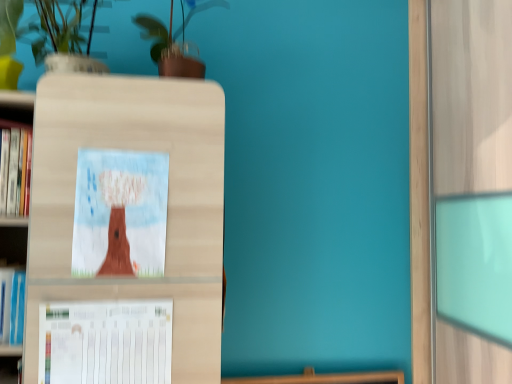
Question: Considering their positions, is white paper at lower left located in front of or behind green glossy plant at upper center?

Choices:
 (A) front
 (B) behind

Answer: (A)

Question: Would you say white paper at lower left is inside or outside green glossy plant at upper center?

Choices:
 (A) inside
 (B) outside

Answer: (B)

Question: Estimate the real-world distances between objects in this image. Which object is farther from the green glossy plant at upper center?

Choices:
 (A) matte cardboard picture frame at center
 (B) white matte vase at upper left
 (C) white paper at lower left

Answer: (C)

Question: Which object is positioned closest to the white paper at lower left?

Choices:
 (A) green glossy plant at upper center
 (B) matte cardboard picture frame at center
 (C) white matte vase at upper left

Answer: (B)